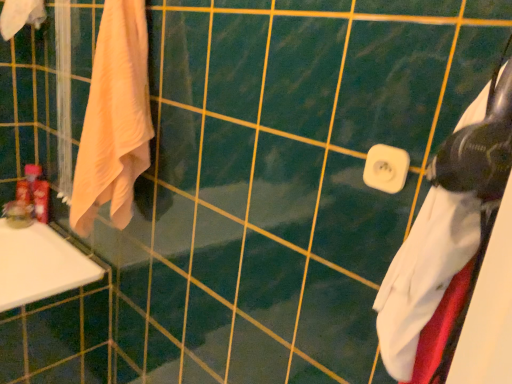
Question: Considering the relative sizes of matte plastic toothpaste tube at left, positioned as the first toiletry in right-to-left order, and white plastic towel bar at center in the image provided, is matte plastic toothpaste tube at left, positioned as the first toiletry in right-to-left order, smaller than white plastic towel bar at center?

Choices:
 (A) yes
 (B) no

Answer: (B)

Question: Is matte plastic toothpaste tube at left, the 2th toiletry in the left-to-right sequence, oriented towards white plastic towel bar at center?

Choices:
 (A) yes
 (B) no

Answer: (A)

Question: Is matte plastic toothpaste tube at left, positioned as the first toiletry in right-to-left order, shorter than white plastic towel bar at center?

Choices:
 (A) no
 (B) yes

Answer: (A)

Question: Is white plastic towel bar at center surrounded by matte plastic toothpaste tube at left, the 2th toiletry in the left-to-right sequence?

Choices:
 (A) no
 (B) yes

Answer: (A)

Question: Is matte plastic toothpaste tube at left, the 2th toiletry in the left-to-right sequence, wider than white plastic towel bar at center?

Choices:
 (A) no
 (B) yes

Answer: (B)

Question: Is matte plastic toothpaste tube at left, positioned as the first toiletry in right-to-left order, with white plastic towel bar at center?

Choices:
 (A) no
 (B) yes

Answer: (A)

Question: Does white matte towel at right, the 1th towel positioned from the front, lie in front of white plastic towel bar at center?

Choices:
 (A) yes
 (B) no

Answer: (A)

Question: Can white plastic towel bar at center be found inside white matte towel at right, the 1th towel positioned from the front?

Choices:
 (A) no
 (B) yes

Answer: (A)

Question: Can you see white matte towel at right, positioned as the 1th towel in right-to-left order, touching white plastic towel bar at center?

Choices:
 (A) yes
 (B) no

Answer: (B)

Question: Considering the relative positions of white matte towel at right, which ranks as the third towel in back-to-front order, and white plastic towel bar at center in the image provided, is white matte towel at right, which ranks as the third towel in back-to-front order, to the right of white plastic towel bar at center from the viewer's perspective?

Choices:
 (A) no
 (B) yes

Answer: (B)

Question: Considering the relative sizes of white matte towel at right, the 1th towel positioned from the front, and white plastic towel bar at center in the image provided, is white matte towel at right, the 1th towel positioned from the front, smaller than white plastic towel bar at center?

Choices:
 (A) yes
 (B) no

Answer: (B)

Question: From a real-world perspective, is white matte towel at right, which appears as the 3th towel when viewed from the left, physically above white plastic towel bar at center?

Choices:
 (A) yes
 (B) no

Answer: (B)

Question: Can you confirm if matte plastic toiletries at left, the first toiletry positioned from the left, is smaller than light peach cotton towel at left, arranged as the second towel when viewed from the right?

Choices:
 (A) yes
 (B) no

Answer: (A)